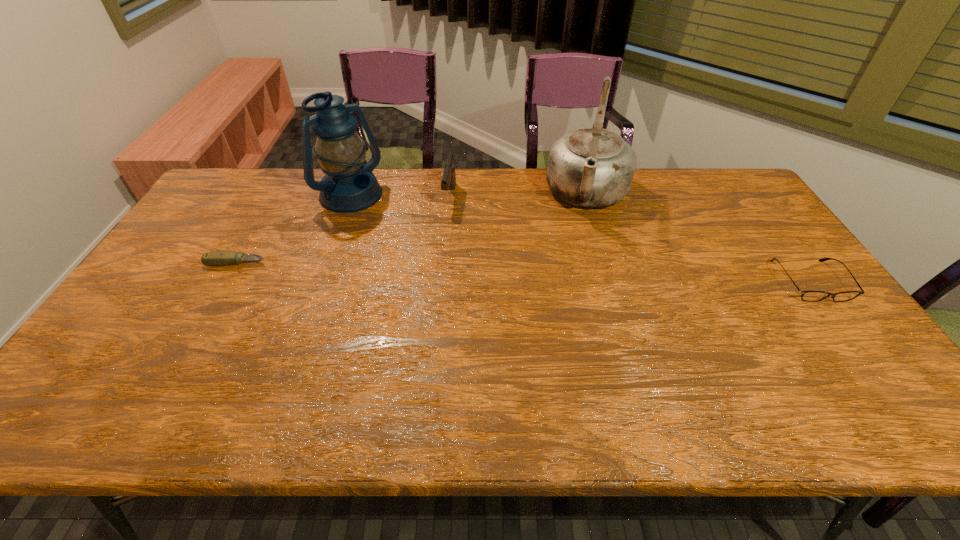
Locate an element on the screen. The width and height of the screenshot is (960, 540). free spot between the lantern and the pocketknife is located at coordinates (293, 230).

Identify the location of free spot between the third tallest object and the leftmost object. The image size is (960, 540). (343, 230).

Where is `free area in between the third object from left to right and the lantern`? The image size is (960, 540). free area in between the third object from left to right and the lantern is located at coordinates (399, 198).

Locate an element on the screen. This screenshot has height=540, width=960. vacant region between the third shortest object and the lantern is located at coordinates (399, 198).

The height and width of the screenshot is (540, 960). Identify the location of unoccupied area between the fourth object from left to right and the lantern. (468, 197).

Locate an element on the screen. The image size is (960, 540). unoccupied area between the pistol and the kettle is located at coordinates 518,196.

This screenshot has width=960, height=540. Identify the location of free space between the second object from left to right and the pocketknife. (293, 230).

I want to click on vacant space that is in between the spectacles and the second object from left to right, so click(580, 240).

Image resolution: width=960 pixels, height=540 pixels. Find the location of `free area in between the leftmost object and the lantern`. free area in between the leftmost object and the lantern is located at coordinates (293, 230).

What are the coordinates of `free space between the leftmost object and the rightmost object` in the screenshot? It's located at (523, 272).